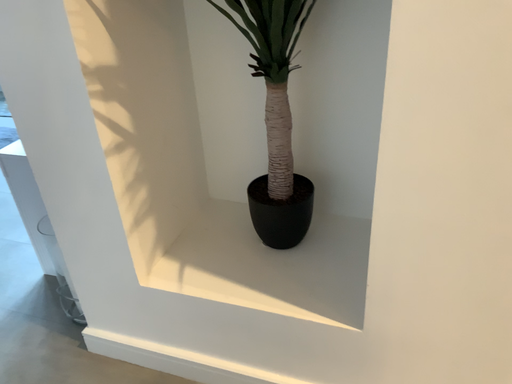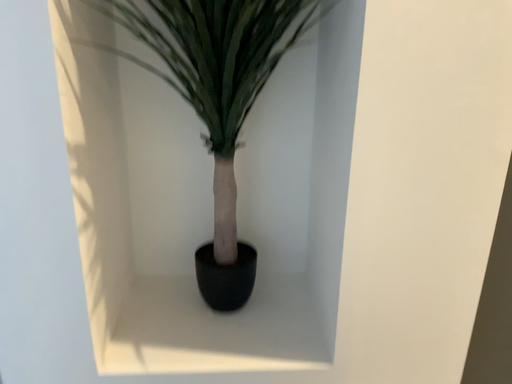
Question: How did the camera likely rotate when shooting the video?

Choices:
 (A) rotated right
 (B) rotated left

Answer: (A)